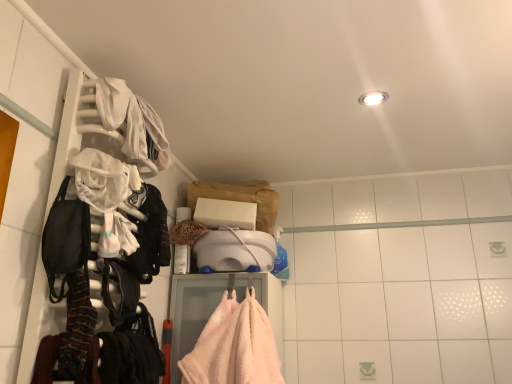
Question: Would you consider black fabric backpack at left to be distant from white fabric at upper left, arranged as the first clothing when viewed from the back?

Choices:
 (A) no
 (B) yes

Answer: (A)

Question: Is black fabric backpack at left further to camera compared to white fabric at upper left, marked as the first clothing in a top-to-bottom arrangement?

Choices:
 (A) no
 (B) yes

Answer: (A)

Question: From the image's perspective, does black fabric backpack at left appear higher than white fabric at upper left, arranged as the first clothing when viewed from the back?

Choices:
 (A) no
 (B) yes

Answer: (A)

Question: Is black fabric backpack at left facing away from white fabric at upper left, marked as the first clothing in a top-to-bottom arrangement?

Choices:
 (A) yes
 (B) no

Answer: (B)

Question: From a real-world perspective, does black fabric backpack at left sit lower than white fabric at upper left, marked as the first clothing in a top-to-bottom arrangement?

Choices:
 (A) yes
 (B) no

Answer: (A)

Question: From a real-world perspective, relative to black fabric backpack at left, is striped wool scarf at left, the 1th clothing in the front-to-back sequence, vertically above or below?

Choices:
 (A) above
 (B) below

Answer: (B)

Question: Visually, is striped wool scarf at left, the first clothing ordered from the bottom, positioned to the left or to the right of black fabric backpack at left?

Choices:
 (A) right
 (B) left

Answer: (A)

Question: From the image's perspective, relative to black fabric backpack at left, is striped wool scarf at left, the second clothing when ordered from back to front, above or below?

Choices:
 (A) below
 (B) above

Answer: (A)

Question: Which is correct: striped wool scarf at left, the second clothing when ordered from back to front, is inside black fabric backpack at left, or outside of it?

Choices:
 (A) outside
 (B) inside

Answer: (A)

Question: In terms of size, does black fabric backpack at left appear bigger or smaller than white plastic hanger at left?

Choices:
 (A) big
 (B) small

Answer: (B)

Question: Considering the positions of black fabric backpack at left and white plastic hanger at left in the image, is black fabric backpack at left taller or shorter than white plastic hanger at left?

Choices:
 (A) tall
 (B) short

Answer: (B)

Question: Would you say black fabric backpack at left is to the left or to the right of white plastic hanger at left in the picture?

Choices:
 (A) left
 (B) right

Answer: (A)

Question: From a real-world perspective, is black fabric backpack at left above or below white plastic hanger at left?

Choices:
 (A) below
 (B) above

Answer: (A)

Question: Relative to white fabric at upper left, the 2th clothing when ordered from bottom to top, is striped wool scarf at left, the 1th clothing in the front-to-back sequence, in front or behind?

Choices:
 (A) behind
 (B) front

Answer: (B)

Question: From their relative heights in the image, would you say striped wool scarf at left, the second clothing when ordered from back to front, is taller or shorter than white fabric at upper left, marked as the first clothing in a top-to-bottom arrangement?

Choices:
 (A) tall
 (B) short

Answer: (A)